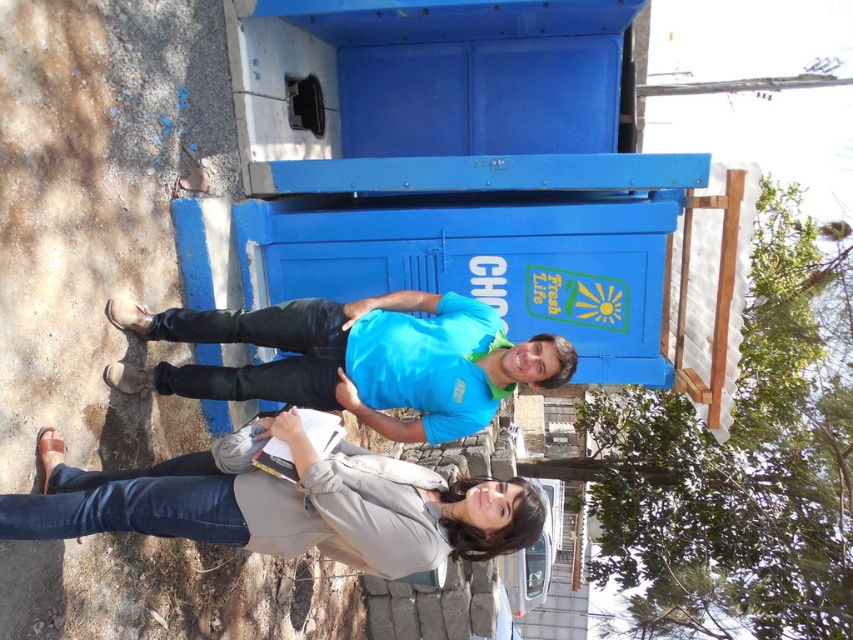
Question: Is light gray fabric jacket at lower center below matte blue shirt at center?

Choices:
 (A) no
 (B) yes

Answer: (B)

Question: Which point is farther to the camera?

Choices:
 (A) (311, 506)
 (B) (407, 392)

Answer: (B)

Question: Is light gray fabric jacket at lower center closer to the viewer compared to matte blue shirt at center?

Choices:
 (A) no
 (B) yes

Answer: (B)

Question: Which point is farther to the camera?

Choices:
 (A) matte blue shirt at center
 (B) light gray fabric jacket at lower center

Answer: (A)

Question: Does light gray fabric jacket at lower center appear on the left side of matte blue shirt at center?

Choices:
 (A) yes
 (B) no

Answer: (A)